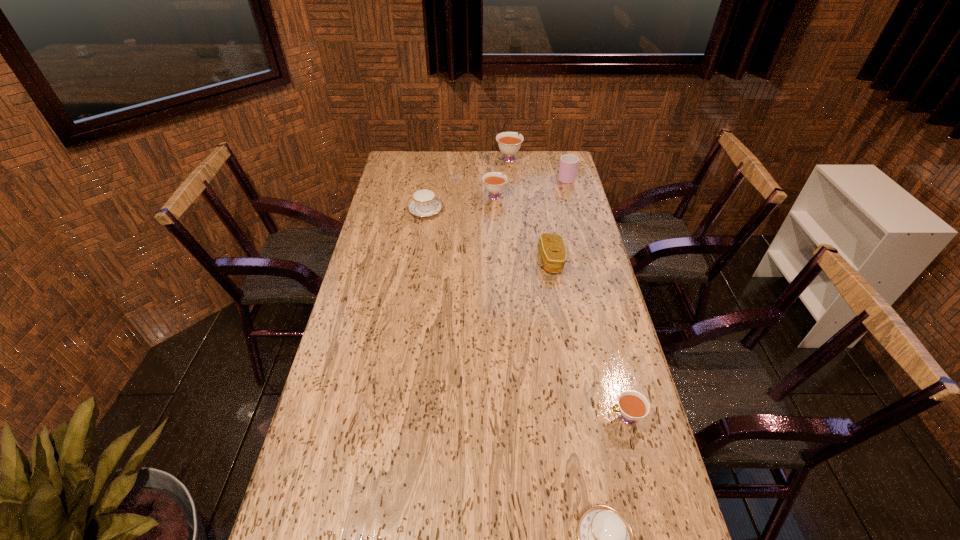
The width and height of the screenshot is (960, 540). Find the location of `teacup situated at the right edge`. teacup situated at the right edge is located at coordinates (633, 406).

I want to click on object located at the far right corner, so click(x=568, y=166).

Identify the location of vacant area at the far edge of the desktop. The height and width of the screenshot is (540, 960). (494, 165).

Find the location of a particular element. The image size is (960, 540). free space at the left edge is located at coordinates (385, 191).

In order to click on vacant space at the right edge of the desktop in this screenshot , I will do `click(548, 181)`.

The height and width of the screenshot is (540, 960). In order to click on vacant space at the far left corner of the desktop in this screenshot , I will do `click(417, 152)`.

This screenshot has height=540, width=960. In the image, there is a desktop. In order to click on vacant space at the far right corner in this screenshot , I will do `click(542, 175)`.

Where is `free space between the leftmost object and the farthest object`? The image size is (960, 540). free space between the leftmost object and the farthest object is located at coordinates (468, 185).

This screenshot has width=960, height=540. What are the coordinates of `free space between the rightmost teacup and the clutch bag` in the screenshot? It's located at (588, 339).

You are a GUI agent. You are given a task and a screenshot of the screen. Output one action in this format:
    pyautogui.click(x=<x>, y=<y>)
    Task: Click on the free spot between the sixth nearest object and the clutch bag
    
    Given the screenshot: What is the action you would take?
    pyautogui.click(x=559, y=219)